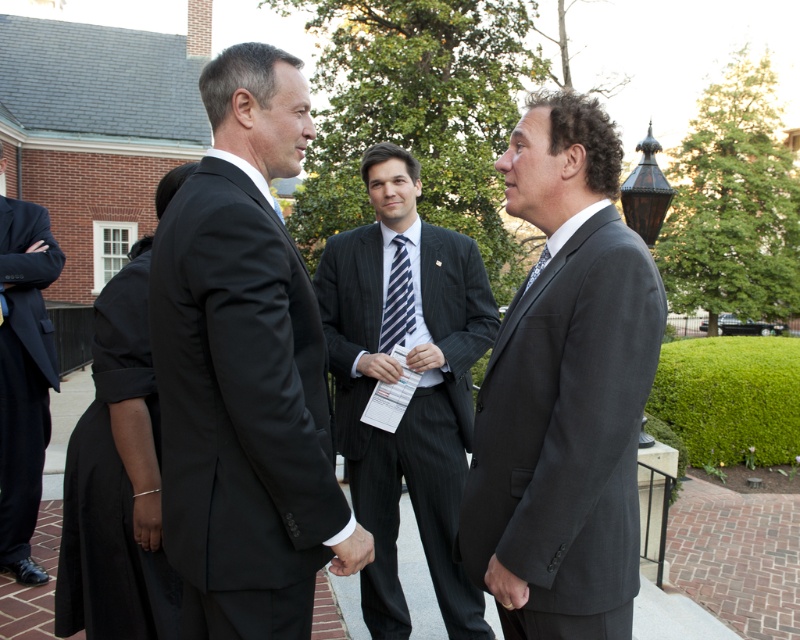
Does dark gray suit at left have a greater width compared to striped fabric tie at center?

Correct, the width of dark gray suit at left exceeds that of striped fabric tie at center.

The width and height of the screenshot is (800, 640). Identify the location of dark gray suit at left. click(x=24, y=378).

Locate an element on the screen. This screenshot has height=640, width=800. dark gray suit at left is located at coordinates (24, 378).

Which of these two, striped fabric tie at center or blue striped tie at center, stands shorter?

Standing shorter between the two is blue striped tie at center.

Is point (394, 275) behind point (538, 259)?

Yes, point (394, 275) is behind point (538, 259).

Where is `striped fabric tie at center`? striped fabric tie at center is located at coordinates (397, 300).

In order to click on striped fabric tie at center in this screenshot , I will do `click(397, 300)`.

Based on the photo, which is more to the left, dark gray suit at left or blue striped tie at center?

Positioned to the left is dark gray suit at left.

Which is more to the right, dark gray suit at left or blue striped tie at center?

Positioned to the right is blue striped tie at center.

Which is in front, point (5, 534) or point (544, 252)?

Positioned in front is point (544, 252).

Locate an element on the screen. dark gray suit at left is located at coordinates (24, 378).